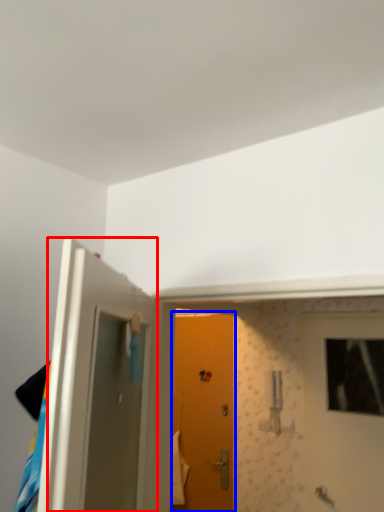
Question: Among these objects, which one is nearest to the camera, door (highlighted by a red box) or door (highlighted by a blue box)?

Choices:
 (A) door
 (B) door

Answer: (A)